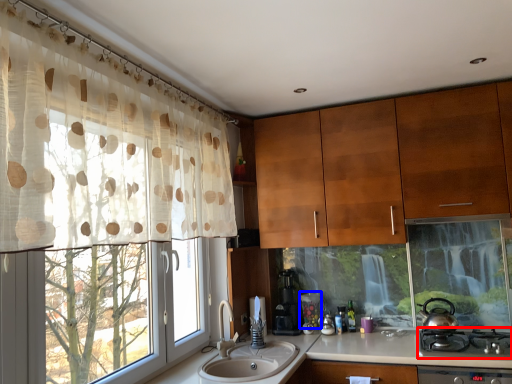
Question: Among these objects, which one is nearest to the camera, gas stove (highlighted by a red box) or appliance (highlighted by a blue box)?

Choices:
 (A) gas stove
 (B) appliance

Answer: (A)